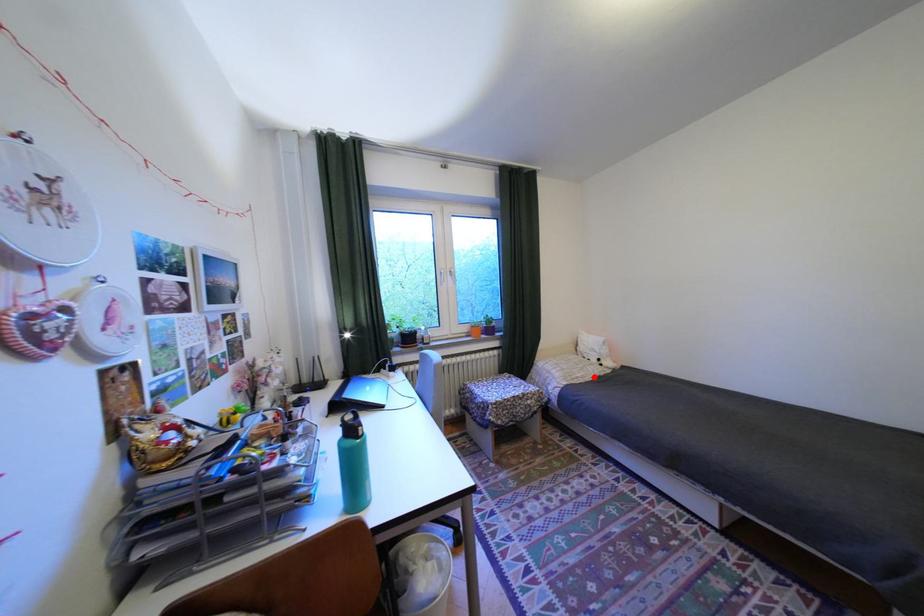
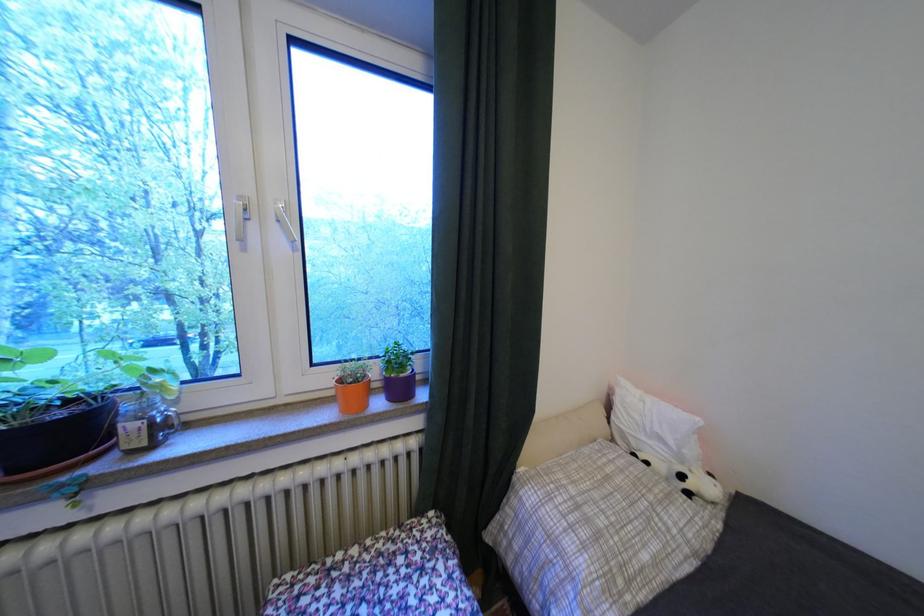
In the second image, find the point that corresponds to the highlighted location in the first image.

(667, 562)